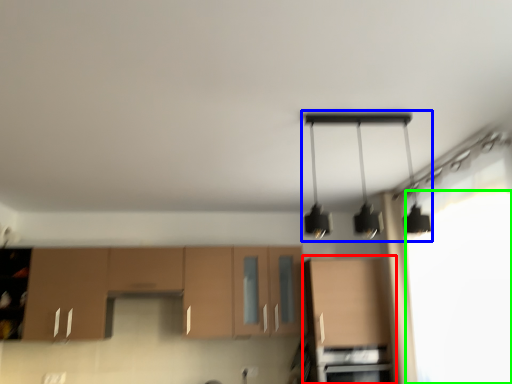
Question: Which object is the farthest from cabinetry (highlighted by a red box)? Choose among these: lamp (highlighted by a blue box) or window screen (highlighted by a green box).

Choices:
 (A) lamp
 (B) window screen

Answer: (A)